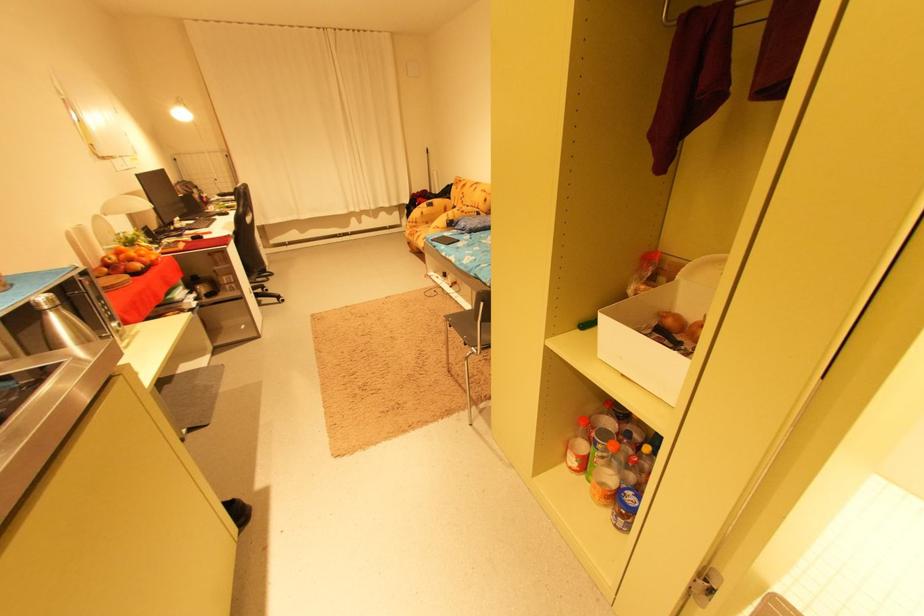
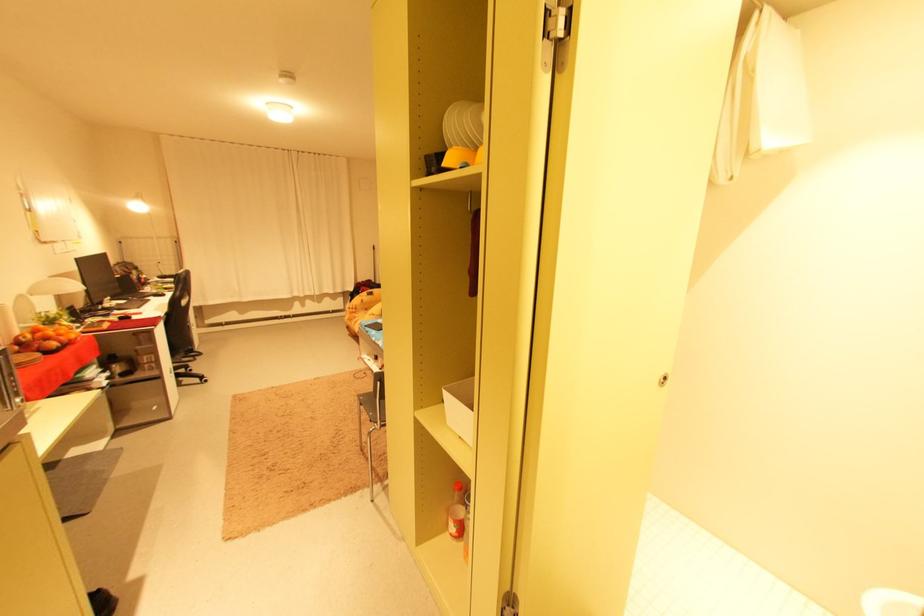
Question: Based on the continuous images, in which direction is the camera rotating? Reply with the corresponding letter.

Choices:
 (A) Left
 (B) Right
 (C) Up
 (D) Down

Answer: (C)